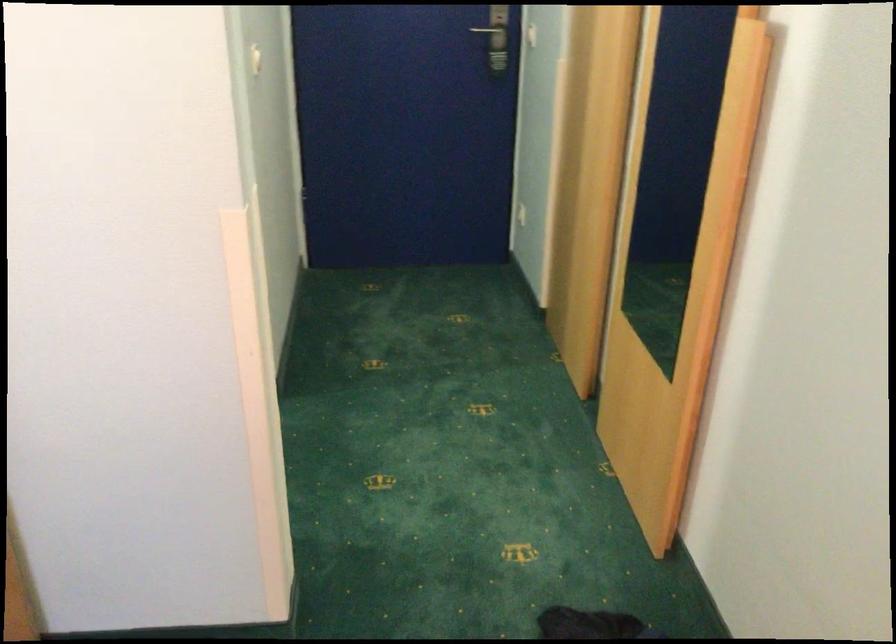
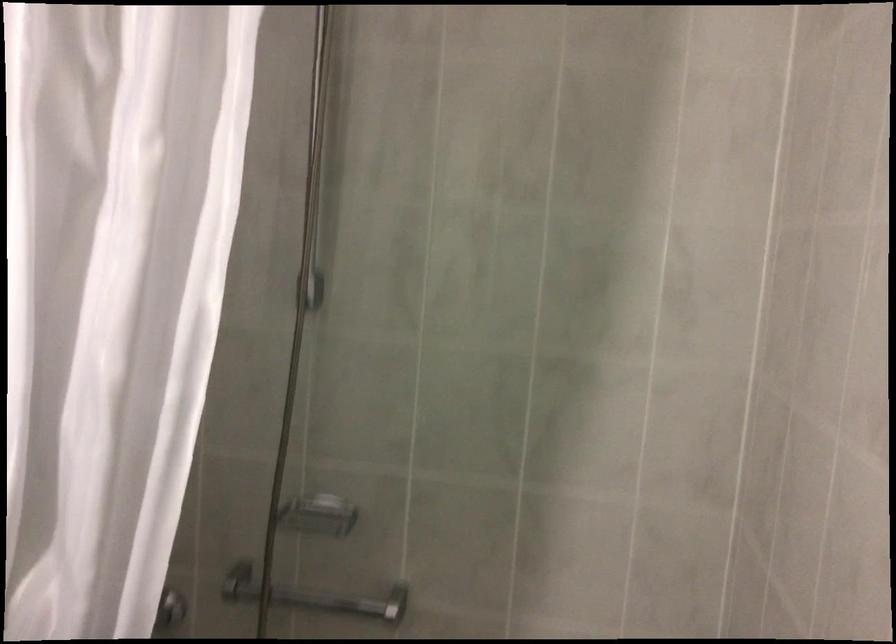
Consider the image. What movement of the cameraman would produce the second image?

The cameraman moved toward left, forward.